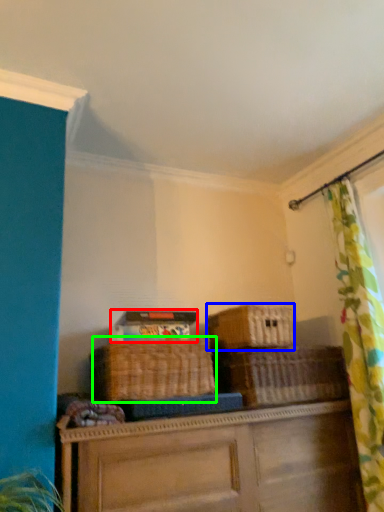
Question: Considering the real-world distances, which object is closest to storage box (highlighted by a red box)? basket (highlighted by a blue box) or basket (highlighted by a green box).

Choices:
 (A) basket
 (B) basket

Answer: (B)